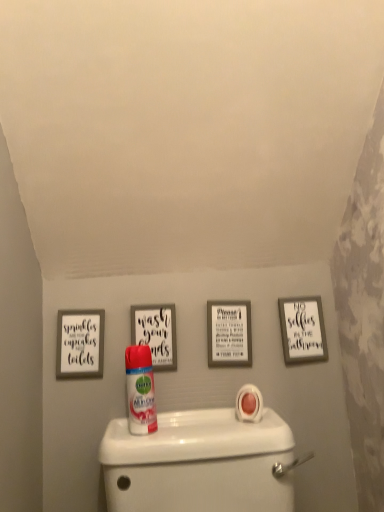
Question: Is white matte picture frame at upper right, acting as the fourth picture frame starting from the left, inside or outside of white glossy toilet at lower center?

Choices:
 (A) outside
 (B) inside

Answer: (A)

Question: Is white matte picture frame at upper right, placed as the 1th picture frame when sorted from right to left, to the left or to the right of white glossy toilet at lower center in the image?

Choices:
 (A) right
 (B) left

Answer: (A)

Question: Estimate the real-world distances between objects in this image. Which object is closer to the white matte picture frame at upper right, placed as the 1th picture frame when sorted from right to left?

Choices:
 (A) white plastic can at center
 (B) white glossy toilet at lower center
 (C) white matte picture frame at upper left, arranged as the 4th picture frame when viewed from the right
 (D) white matte picture frame at center, which is the third picture frame in left-to-right order
 (E) matte black picture frame at center, which ranks as the second picture frame in left-to-right order

Answer: (D)

Question: Considering the real-world distances, which object is farthest from the white matte picture frame at upper right, placed as the 1th picture frame when sorted from right to left?

Choices:
 (A) matte black picture frame at center, which ranks as the second picture frame in left-to-right order
 (B) white matte picture frame at center, which is the third picture frame in left-to-right order
 (C) white plastic can at center
 (D) white matte picture frame at upper left, arranged as the first picture frame when viewed from the left
 (E) white glossy toilet at lower center

Answer: (D)